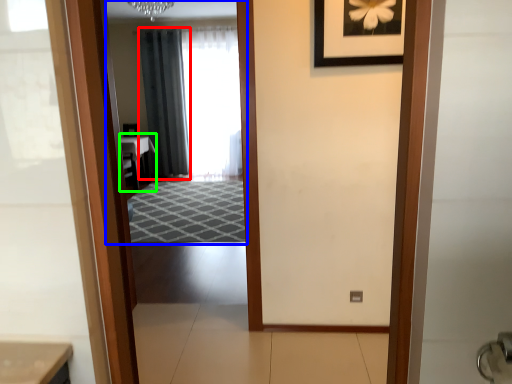
Question: Estimate the real-world distances between objects in this image. Which object is closer to curtain (highlighted by a red box), mirror (highlighted by a blue box) or table (highlighted by a green box)?

Choices:
 (A) mirror
 (B) table

Answer: (A)